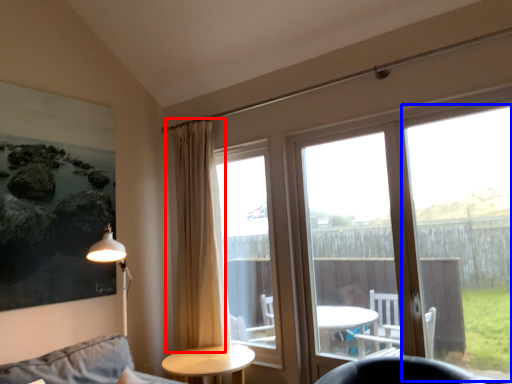
Question: Which object is further to the camera taking this photo, curtain (highlighted by a red box) or window frame (highlighted by a blue box)?

Choices:
 (A) curtain
 (B) window frame

Answer: (A)